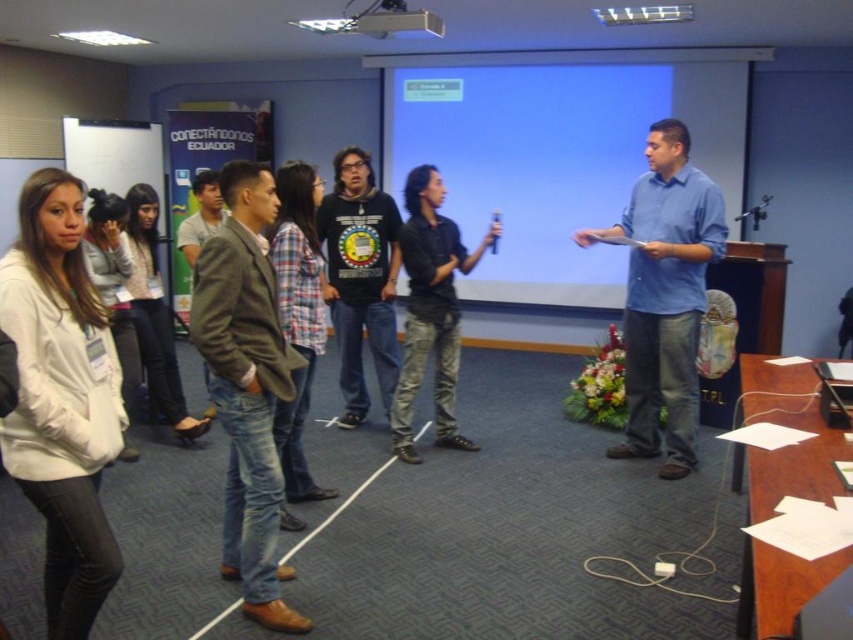
In the conference room scene, there are two people mentioned in the objects. The first is a woman in a white hoodie and black pants on the left, and the second is a point labeled at coordinates (200, 216). What is the spatial relationship between the woman in the white hoodie and the green textured jacket at center?

The green textured jacket at center is located to the right of the woman in the white hoodie and black pants on the left.

You are standing in the conference room and need to take a photo of the dark blue shirt at center. The camera you have is 12 feet in range. Can you take the photo with the camera you have?

The dark blue shirt at center and camera are 12.40 feet apart from each other. Since the camera has a 12 feet range, it is slightly out of range. You need to move closer by 0.40 feet to capture the photo.